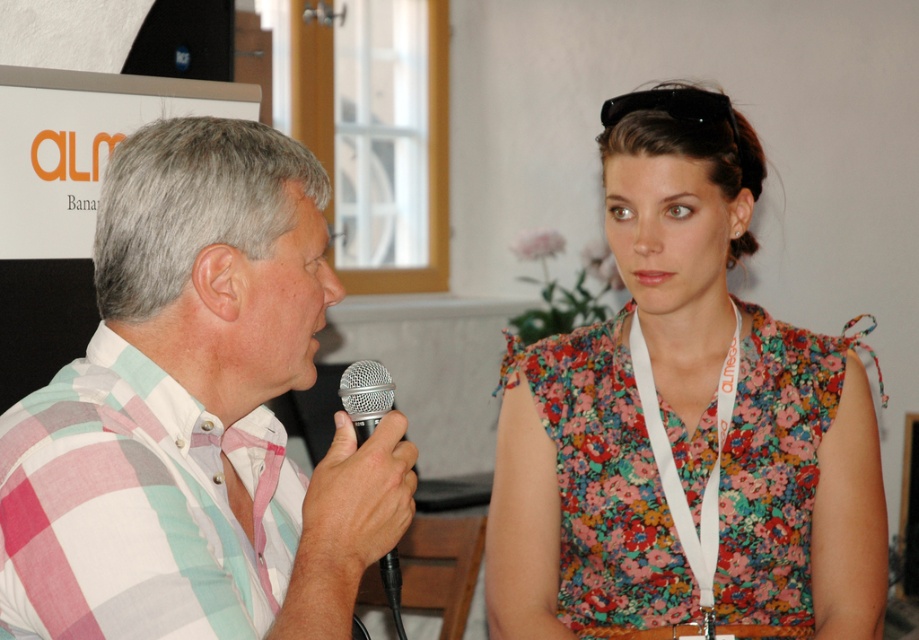
Can you confirm if floral fabric blouse at upper right is bigger than checkered fabric shirt at left?

Yes.

Looking at this image, does floral fabric blouse at upper right appear over checkered fabric shirt at left?

Correct, floral fabric blouse at upper right is located above checkered fabric shirt at left.

Does point (689, 609) lie in front of point (49, 566)?

That is False.

This screenshot has height=640, width=919. Identify the location of floral fabric blouse at upper right. (684, 424).

Who is positioned more to the right, floral fabric blouse at upper right or silver metallic microphone at center?

floral fabric blouse at upper right

Is floral fabric blouse at upper right to the right of silver metallic microphone at center from the viewer's perspective?

Correct, you'll find floral fabric blouse at upper right to the right of silver metallic microphone at center.

Does point (648, 259) lie behind point (392, 573)?

Yes, point (648, 259) is farther from viewer.

You are a GUI agent. You are given a task and a screenshot of the screen. Output one action in this format:
    pyautogui.click(x=<x>, y=<y>)
    Task: Click on the floral fabric blouse at upper right
    Image resolution: width=919 pixels, height=640 pixels.
    Given the screenshot: What is the action you would take?
    pyautogui.click(x=684, y=424)

Is point (254, 456) less distant than point (388, 570)?

No, (254, 456) is behind (388, 570).

Who is more forward, (x=149, y=385) or (x=386, y=588)?

Point (x=149, y=385) is in front.

Does point (344, 512) lie in front of point (392, 397)?

That is True.

Locate an element on the screen. Image resolution: width=919 pixels, height=640 pixels. checkered fabric shirt at left is located at coordinates (194, 413).